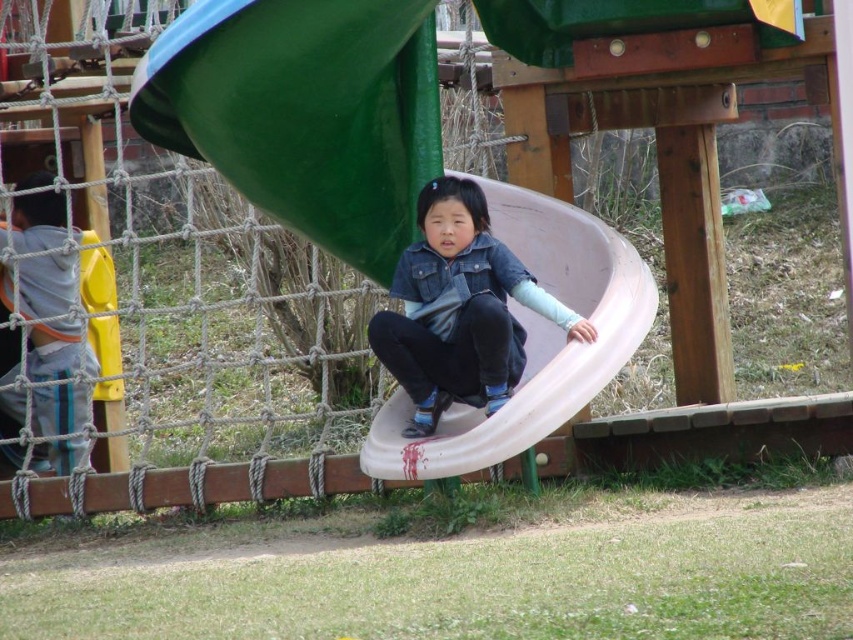
Is point (440, 452) less distant than point (418, 346)?

Yes, it is.

Which is in front, point (384, 465) or point (488, 246)?

Positioned in front is point (384, 465).

What are the coordinates of `white plastic slide at center` in the screenshot? It's located at coord(294,113).

Is white plastic slide at center shorter than gray hoodie at left?

Yes.

Between white plastic slide at center and gray hoodie at left, which one is positioned lower?

white plastic slide at center is lower down.

Is point (367, 106) less distant than point (80, 323)?

Yes, point (367, 106) is in front of point (80, 323).

Identify the location of white plastic slide at center. (294, 113).

Does matte blue slide at center have a greater width compared to gray hoodie at left?

Yes.

The height and width of the screenshot is (640, 853). What do you see at coordinates (459, 308) in the screenshot?
I see `matte blue slide at center` at bounding box center [459, 308].

Who is more distant from viewer, (569, 337) or (61, 225)?

Point (61, 225)

Find the location of a particular element. The height and width of the screenshot is (640, 853). matte blue slide at center is located at coordinates (459, 308).